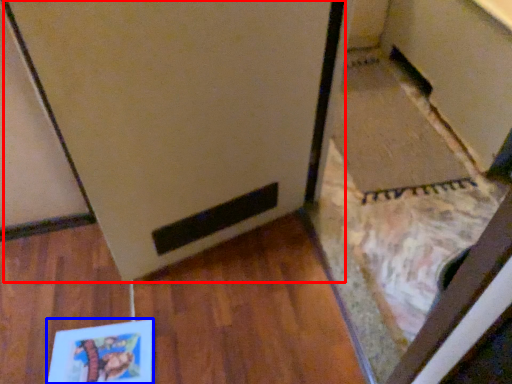
Question: Which of the following is the closest to the observer, fridge (highlighted by a red box) or book (highlighted by a blue box)?

Choices:
 (A) fridge
 (B) book

Answer: (A)